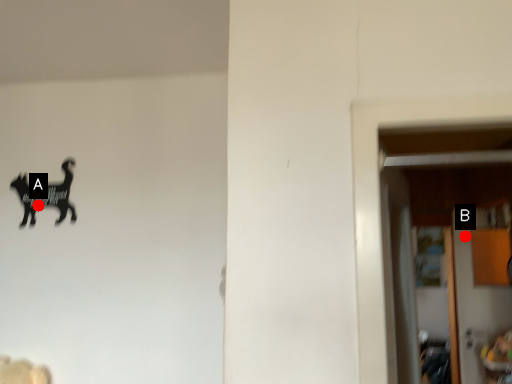
Question: Two points are circled on the image, labeled by A and B beside each circle. Which point is further to the camera?

Choices:
 (A) A is further
 (B) B is further

Answer: (B)